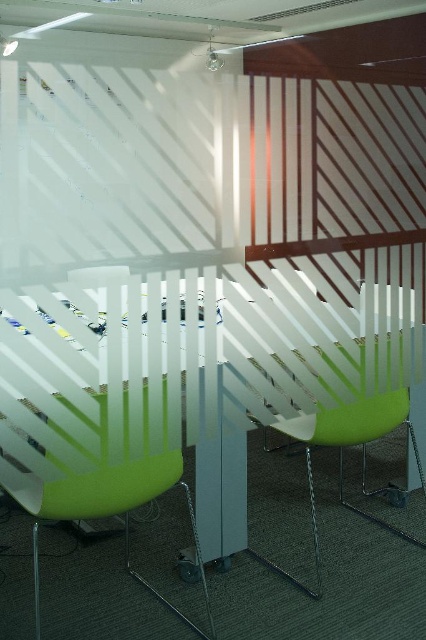
Question: Among these objects, which one is nearest to the camera?

Choices:
 (A) matte green plastic chair at left
 (B) green matte chair at center
 (C) transparent plastic table at center

Answer: (C)

Question: Can you confirm if transparent plastic table at center is positioned below green matte chair at center?

Choices:
 (A) yes
 (B) no

Answer: (B)

Question: Which point is farther to the camera?

Choices:
 (A) pyautogui.click(x=374, y=403)
 (B) pyautogui.click(x=213, y=328)
 (C) pyautogui.click(x=23, y=496)

Answer: (A)

Question: Does matte green plastic chair at left have a larger size compared to green matte chair at center?

Choices:
 (A) yes
 (B) no

Answer: (A)

Question: Observing the image, what is the correct spatial positioning of matte green plastic chair at left in reference to green matte chair at center?

Choices:
 (A) below
 (B) above

Answer: (B)

Question: Which object is farther from the camera taking this photo?

Choices:
 (A) green matte chair at center
 (B) transparent plastic table at center

Answer: (A)